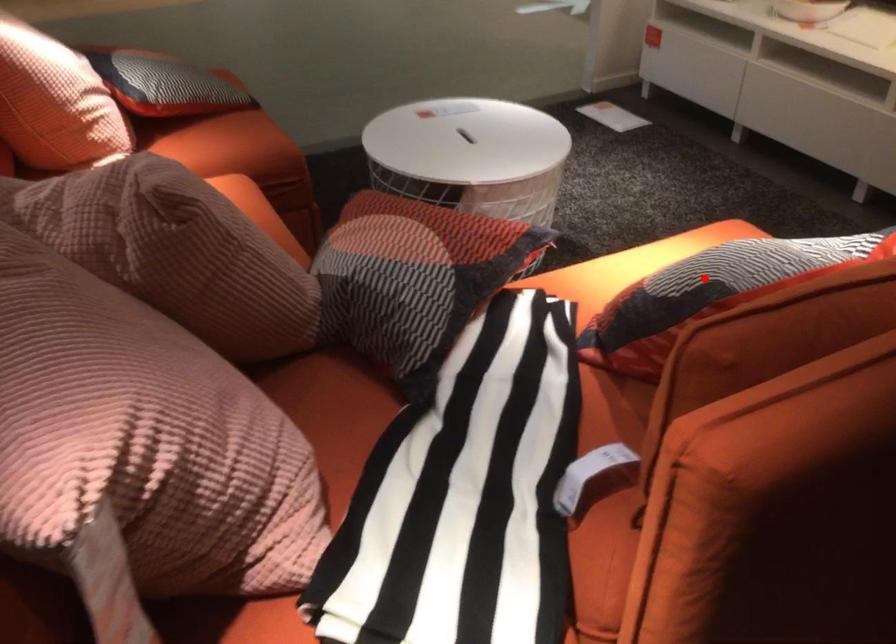
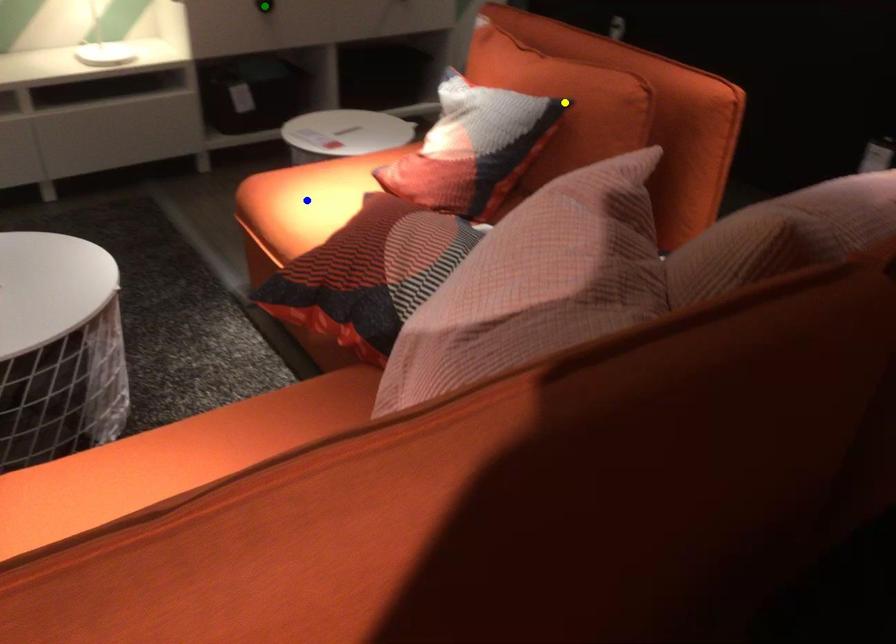
Question: I am providing you with two images of the same scene from different viewpoints. A red point is marked on the first image. You are given multiple points on the second image. In image 2, which mark is for the same physical point as the one in image 1?

Choices:
 (A) blue point
 (B) green point
 (C) yellow point

Answer: (C)